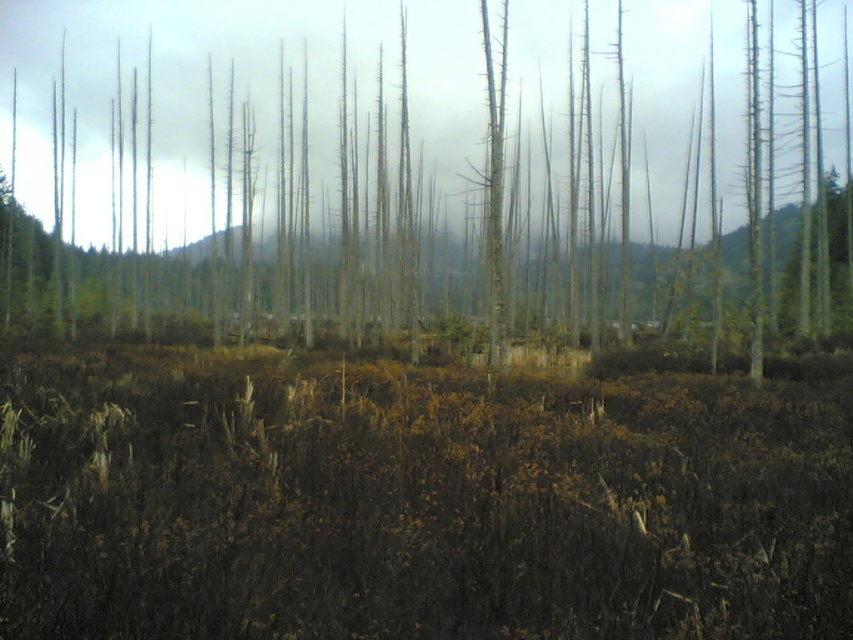
Question: Considering the relative positions of brown dry grass at center and smooth gray tree trunk at center in the image provided, where is brown dry grass at center located with respect to smooth gray tree trunk at center?

Choices:
 (A) right
 (B) left

Answer: (A)

Question: Can you confirm if brown dry grass at center is positioned to the right of smooth gray tree trunk at center?

Choices:
 (A) yes
 (B) no

Answer: (A)

Question: Which of the following is the closest to the observer?

Choices:
 (A) smooth gray tree trunk at center
 (B) brown dry grass at center

Answer: (B)

Question: Observing the image, what is the correct spatial positioning of brown dry grass at center in reference to smooth gray tree trunk at center?

Choices:
 (A) right
 (B) left

Answer: (A)